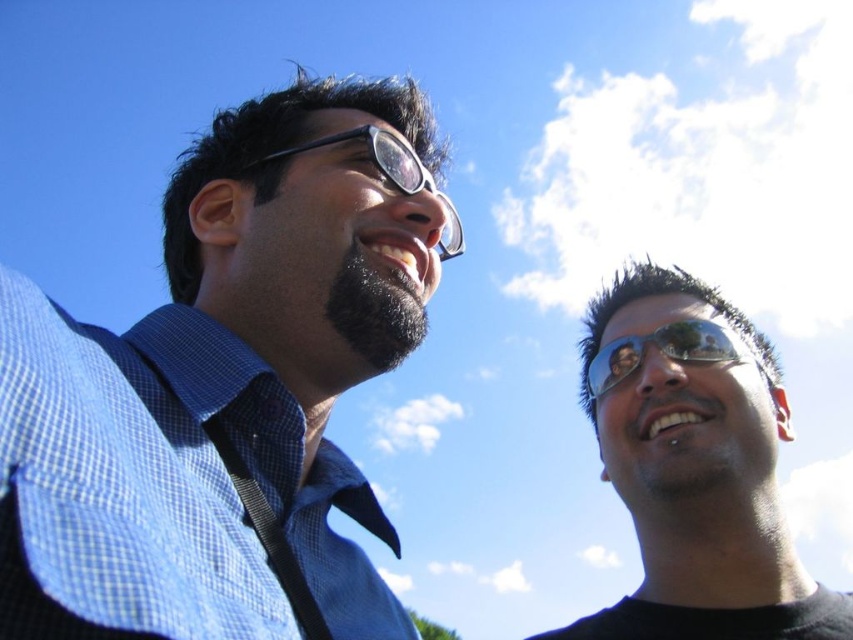
You are a photographer trying to capture a clear shot of the sunglasses at center and the black plastic goggles at upper center. Which object should you focus on first if you want to ensure both are in focus without adjusting the camera settings?

The sunglasses at center should be focused on first because it is positioned under the black plastic goggles at upper center, so focusing on the closer object first allows both to be in focus if they are within the depth of field.

Looking at this image, you are a photographer trying to capture a clear shot of both the blue checkered shirt at left and the black plastic goggles at upper center. Given their positions, which object should you focus on first to ensure it appears sharp in the photo?

The blue checkered shirt at left is taller than the black plastic goggles at upper center, so focusing on the blue checkered shirt at left first will ensure it appears sharp since it occupies more space in the frame.

You are a photographer taking a picture of the blue checkered shirt at left and the black plastic goggles at upper center. Based on their positions, which object is closer to the bottom edge of the photo?

The blue checkered shirt at left is closer to the bottom edge of the photo because it is positioned below the black plastic goggles at upper center.